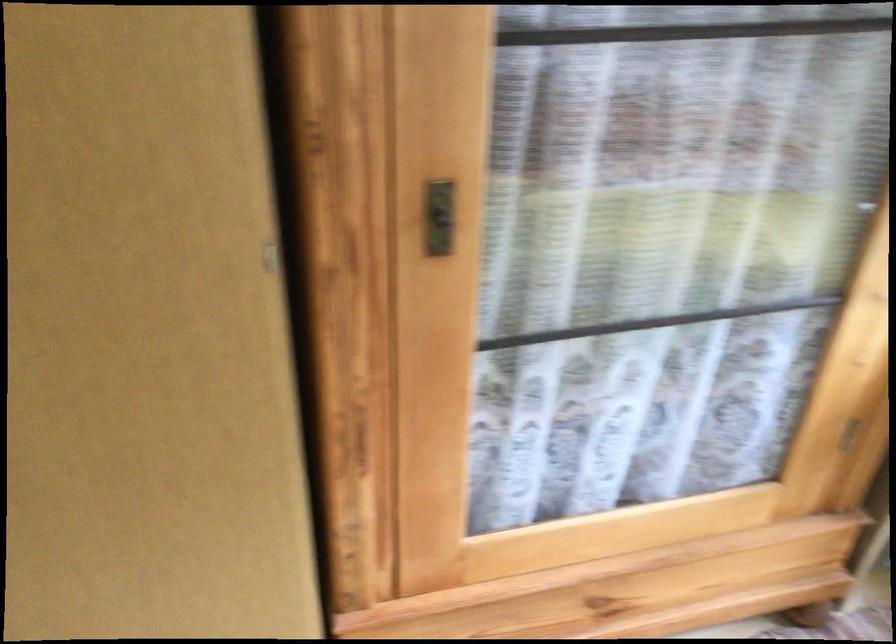
Based on the continuous images, in which direction is the camera rotating?

The camera rotated toward right-down.